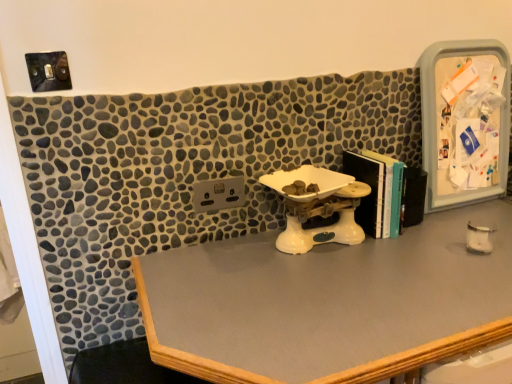
Identify the location of vacant space underneath white plastic scale at center (from a real-world perspective). (324, 246).